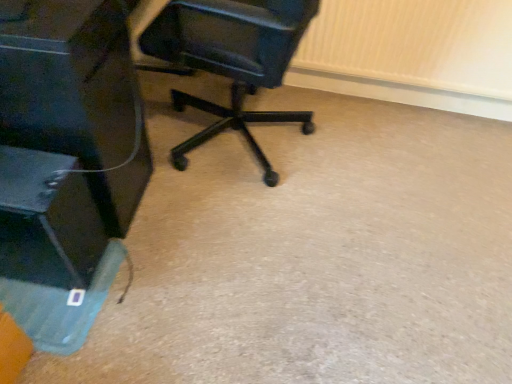
The width and height of the screenshot is (512, 384). I want to click on free spot to the right of black plastic chair at center, so click(390, 174).